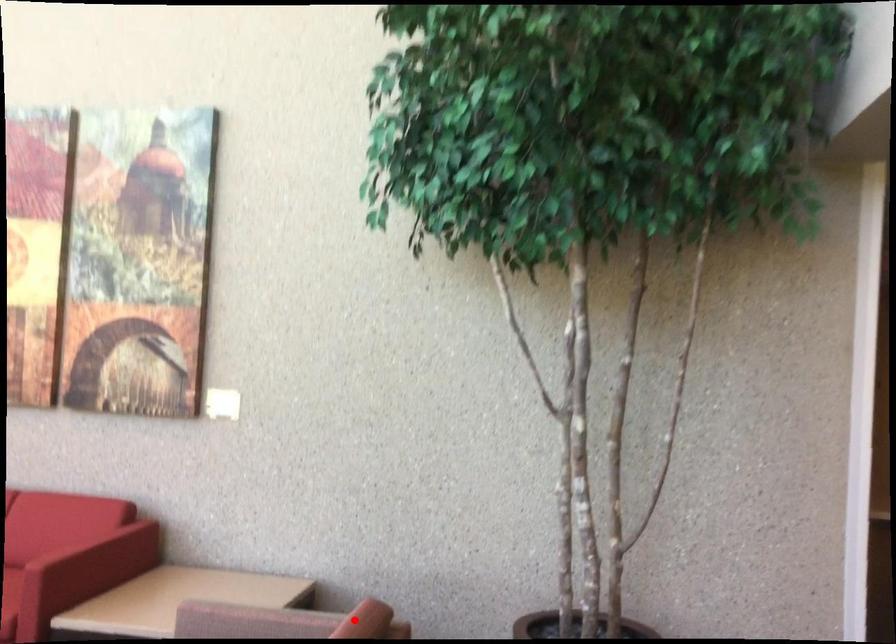
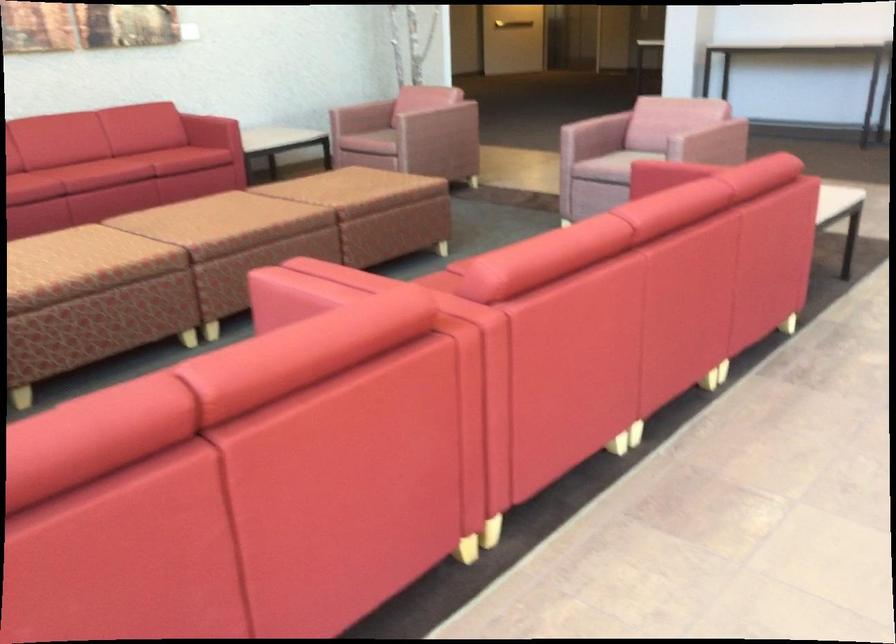
Question: I am providing you with two images of the same scene from different viewpoints. Image1 has a red point marked. In image2, the corresponding 3D location appears at what relative position? Reply with the corresponding letter.

Choices:
 (A) Closer
 (B) Farther

Answer: (B)